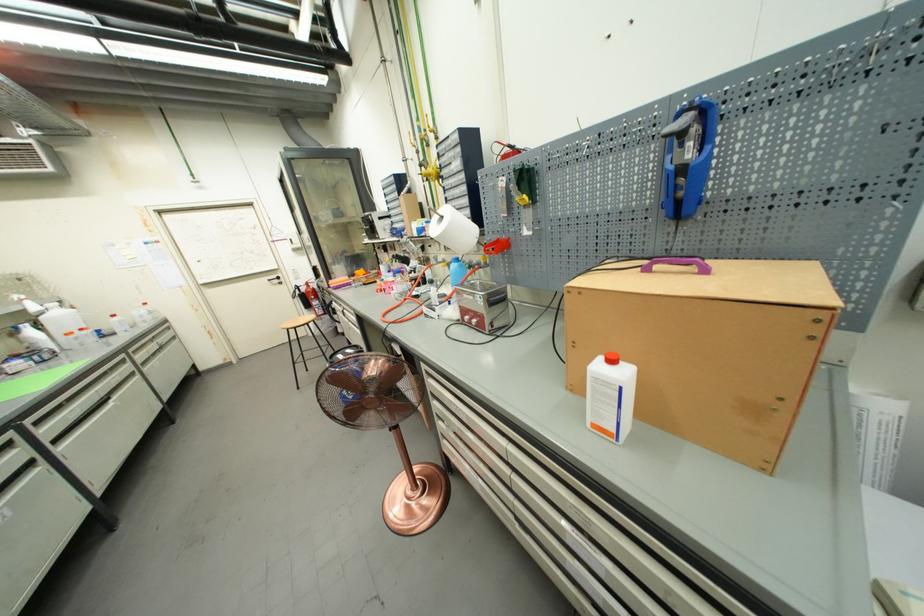
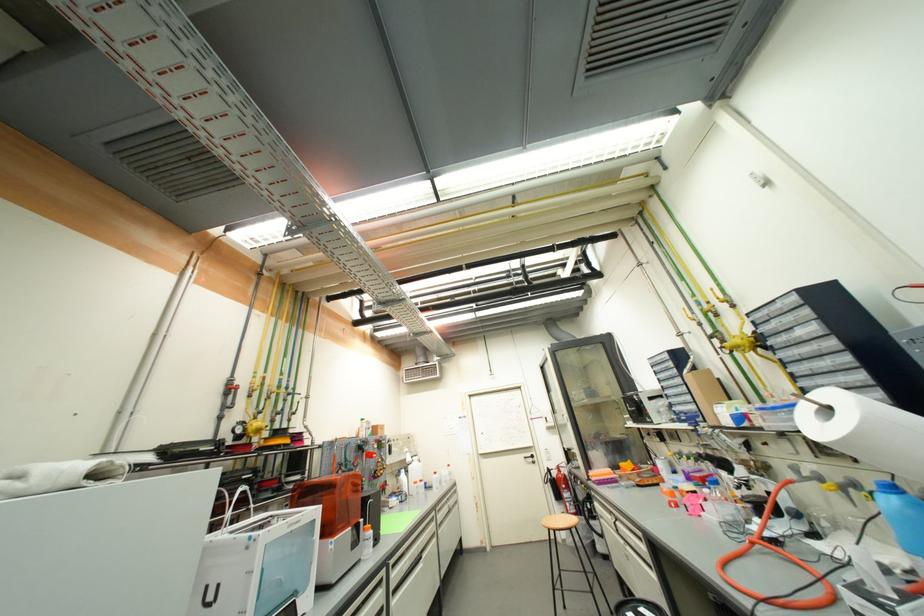
In the second image, find the point that corresponds to pixel 30 312 in the first image.

(410, 461)